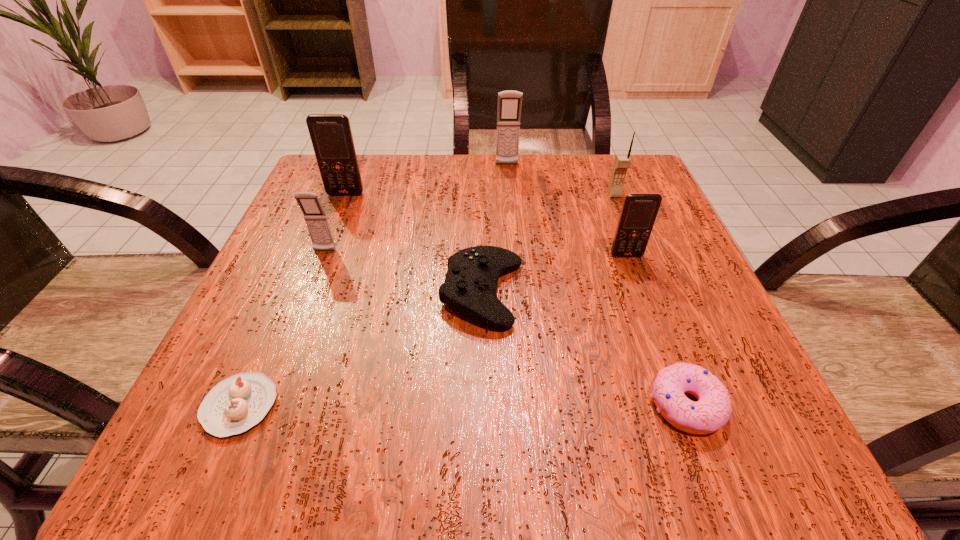
Identify the location of pink doughnut. This screenshot has height=540, width=960. (712, 411).

Locate an element on the screen. This screenshot has height=540, width=960. cupcake is located at coordinates (234, 405).

Identify the location of free region located 0.190m on the front-facing side of the bigger gray cellular telephone. The image size is (960, 540). (512, 215).

The width and height of the screenshot is (960, 540). Identify the location of vacant space located 0.050m on the screen of the left orange cellular telephone. (340, 210).

I want to click on free point located 0.150m on the screen of the smaller orange cellular telephone, so [650, 321].

Locate an element on the screen. vacant space located 0.380m on the front-facing side of the left gray cellular telephone is located at coordinates (245, 456).

This screenshot has width=960, height=540. In order to click on vacant space located 0.130m on the front of the third nearest object in this screenshot , I will do `click(483, 410)`.

Locate an element on the screen. Image resolution: width=960 pixels, height=540 pixels. vacant space located 0.130m on the left of the pink doughnut is located at coordinates (554, 404).

At what (x,y) coordinates should I click in order to perform the action: click on free space located on the right of the cupcake. Please return your answer as a coordinate pair (x, y). This screenshot has width=960, height=540. Looking at the image, I should click on (439, 406).

Identify the location of doughnut that is at the near edge. The height and width of the screenshot is (540, 960). (712, 411).